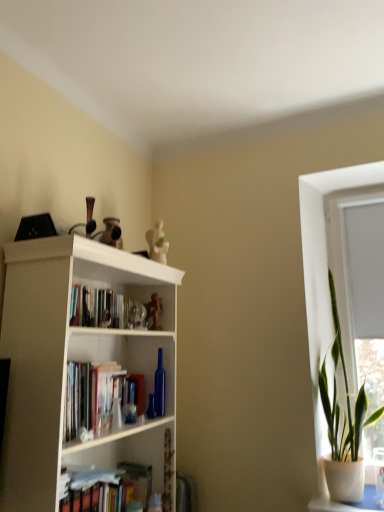
Question: From a real-world perspective, is green leafy plant in pot at right located higher than white matte bookcase at upper left?

Choices:
 (A) no
 (B) yes

Answer: (B)

Question: Is green leafy plant in pot at right aimed at white matte bookcase at upper left?

Choices:
 (A) no
 (B) yes

Answer: (A)

Question: From the image's perspective, would you say green leafy plant in pot at right is positioned over white matte bookcase at upper left?

Choices:
 (A) no
 (B) yes

Answer: (B)

Question: Considering the relative positions of green leafy plant in pot at right and white matte bookcase at upper left in the image provided, is green leafy plant in pot at right to the right of white matte bookcase at upper left from the viewer's perspective?

Choices:
 (A) no
 (B) yes

Answer: (B)

Question: Can you confirm if green leafy plant in pot at right is wider than white matte bookcase at upper left?

Choices:
 (A) yes
 (B) no

Answer: (B)

Question: Is white matte bookcase at upper left to the left or to the right of hardcover books at center in the image?

Choices:
 (A) left
 (B) right

Answer: (B)

Question: Is white matte bookcase at upper left in front of or behind hardcover books at center in the image?

Choices:
 (A) behind
 (B) front

Answer: (B)

Question: In terms of size, does white matte bookcase at upper left appear bigger or smaller than hardcover books at center?

Choices:
 (A) small
 (B) big

Answer: (B)

Question: From a real-world perspective, is white matte bookcase at upper left positioned above or below hardcover books at center?

Choices:
 (A) above
 (B) below

Answer: (B)

Question: Is green leafy plant in pot at right taller or shorter than white plastic window frame at upper right?

Choices:
 (A) short
 (B) tall

Answer: (B)

Question: In terms of width, does green leafy plant in pot at right look wider or thinner when compared to white plastic window frame at upper right?

Choices:
 (A) thin
 (B) wide

Answer: (B)

Question: Is green leafy plant in pot at right to the left or to the right of white plastic window frame at upper right in the image?

Choices:
 (A) left
 (B) right

Answer: (A)

Question: From a real-world perspective, is green leafy plant in pot at right positioned above or below white plastic window frame at upper right?

Choices:
 (A) above
 (B) below

Answer: (B)

Question: Which is correct: hardcover books at center is inside white plastic window frame at upper right, or outside of it?

Choices:
 (A) inside
 (B) outside

Answer: (B)

Question: Is hardcover books at center bigger or smaller than white plastic window frame at upper right?

Choices:
 (A) small
 (B) big

Answer: (A)